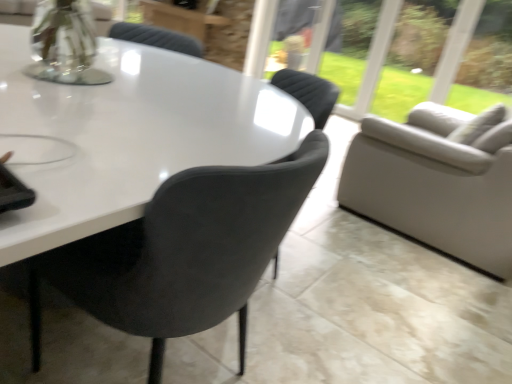
In order to face velvet dark gray chair at center, should I rotate leftwards or rightwards?

It's best to rotate left around 10.218 degrees.

Describe the element at coordinates (189, 250) in the screenshot. Image resolution: width=512 pixels, height=384 pixels. I see `velvet dark gray chair at center` at that location.

You are a GUI agent. You are given a task and a screenshot of the screen. Output one action in this format:
    pyautogui.click(x=<x>, y=<y>)
    Task: Click on the velvet dark gray chair at center
    The width and height of the screenshot is (512, 384).
    Given the screenshot: What is the action you would take?
    coord(189,250)

Where is `velvet dark gray chair at center`? velvet dark gray chair at center is located at coordinates (189, 250).